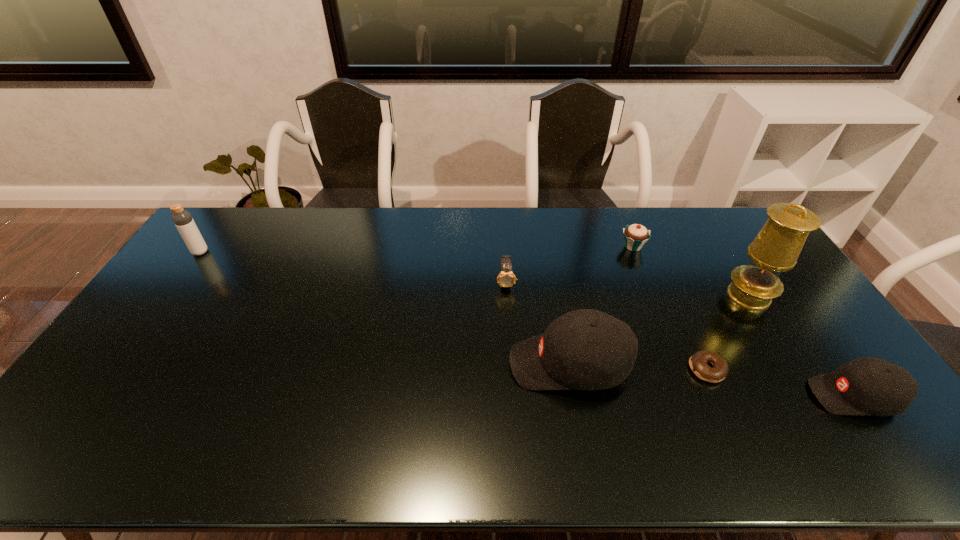
Considering the uniform spacing of baseball caps, where should an additional baseball cap be positioned on the left? Please locate a free spot. Please provide its 2D coordinates. Your answer should be formatted as a tuple, i.e. [(x, y)], where the tuple contains the x and y coordinates of a point satisfying the conditions above.

[(317, 336)]